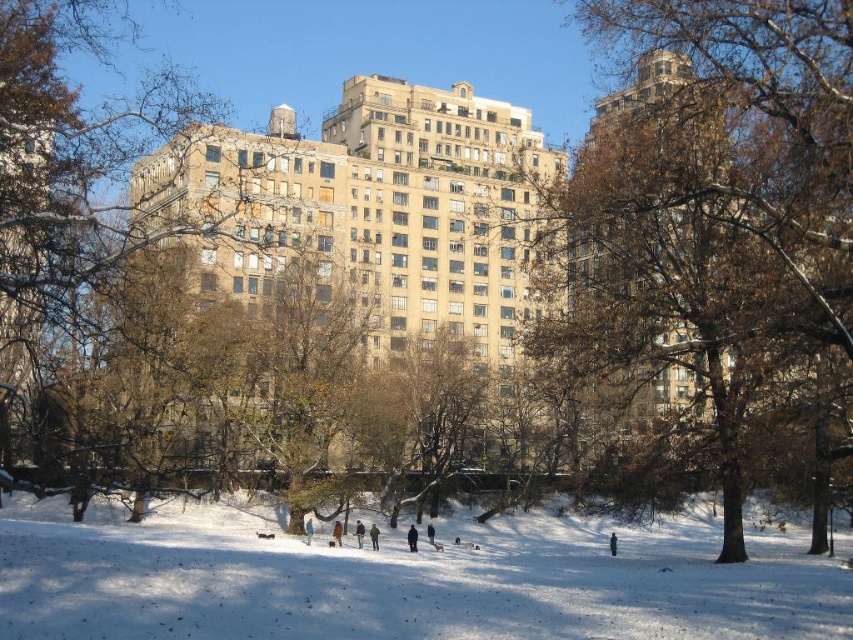
Which is more to the right, dark blue jacket at center or dark blue jacket at lower center?

From the viewer's perspective, dark blue jacket at lower center appears more on the right side.

Is point (363, 536) behind point (431, 528)?

That is False.

You are a GUI agent. You are given a task and a screenshot of the screen. Output one action in this format:
    pyautogui.click(x=<x>, y=<y>)
    Task: Click on the dark blue jacket at center
    This screenshot has width=853, height=640.
    Given the screenshot: What is the action you would take?
    pyautogui.click(x=358, y=532)

What do you see at coordinates (718, 218) in the screenshot?
I see `brown leafy tree at center` at bounding box center [718, 218].

Does brown leafy tree at center appear over brown textured tree at center?

Yes, brown leafy tree at center is above brown textured tree at center.

The width and height of the screenshot is (853, 640). Find the location of `brown leafy tree at center`. brown leafy tree at center is located at coordinates (718, 218).

Is point (148, 230) behind point (357, 532)?

Yes, it is behind point (357, 532).

Where is `brown textured tree at left`? The image size is (853, 640). brown textured tree at left is located at coordinates (67, 172).